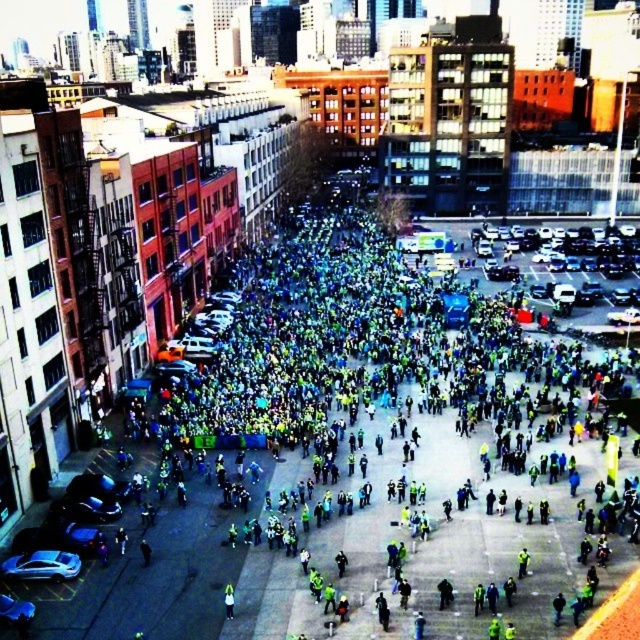
You are a drone operator tasked with capturing aerial footage of the crowd in the urban scene. You need to ensure that both the green reflective jacket at center and the green matte jacket at center are visible in the same frame. Given that your camera has a maximum focal length allowing a horizontal field of view of 10 meters, can you determine if these two jackets can be captured together in one shot?

The green reflective jacket at center and green matte jacket at center are 30.85 meters apart. Since the camera can only capture a horizontal field of view of 10 meters, the distance between them exceeds the camera capabilities, so they cannot be captured together in one shot.

You are a photographer trying to capture a clear shot of both the green reflective jacket at center and the green matte jacket at center. Since you want to ensure both are fully visible in your photo, which jacket should you focus on first to avoid obstruction?

The green reflective jacket at center might be wider than the green matte jacket at center, so focusing on the green reflective jacket at center first would ensure it doesn not block the smaller matte jacket.

Looking at this image, you are a photographer positioned at the edge of the crowd in the urban scene. You want to take a photo of both the green reflective jacket at center and the green matte jacket at center. However, you notice that one is blocking the other. Which jacket is currently obscuring the other?

The green reflective jacket at center is in front of the green matte jacket at center, so it is obscuring the matte jacket.